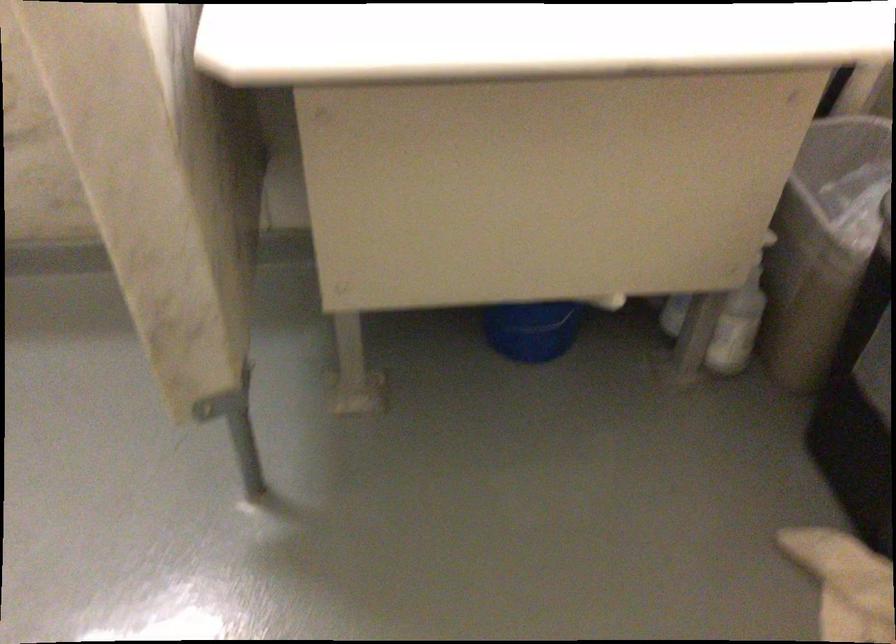
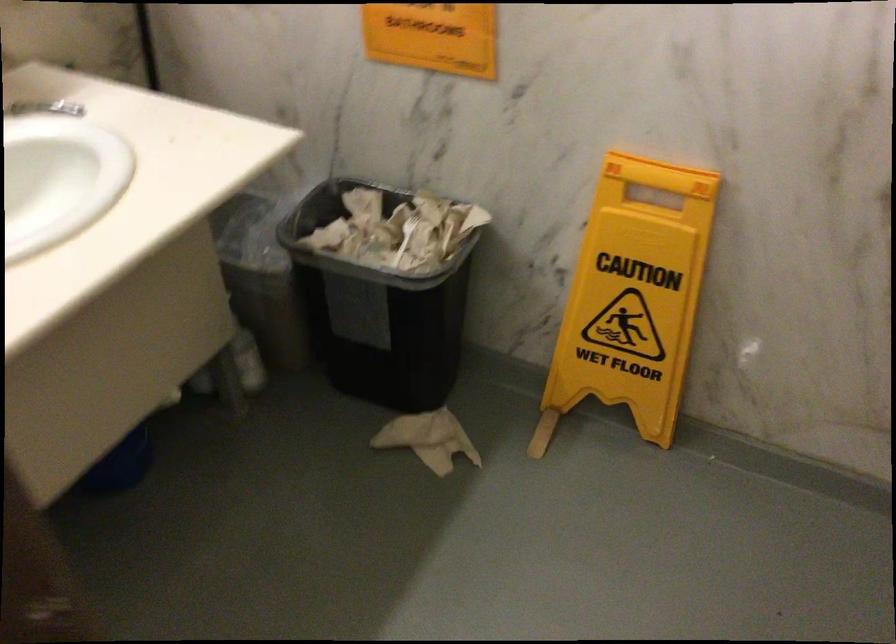
Question: Based on the continuous images, in which direction is the camera rotating? Reply with the corresponding letter.

Choices:
 (A) Left
 (B) Right
 (C) Up
 (D) Down

Answer: (B)